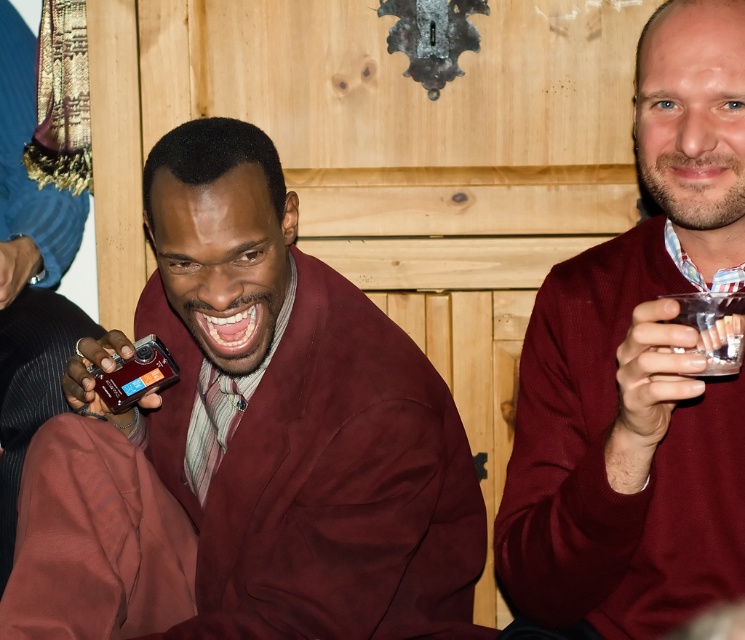
How far apart are matte burgundy sweater at left and maroon sweater at center?

matte burgundy sweater at left is 14.62 inches from maroon sweater at center.

The image size is (745, 640). Find the location of `matte burgundy sweater at left`. matte burgundy sweater at left is located at coordinates coord(247,442).

Find the location of `matte burgundy sweater at left`. matte burgundy sweater at left is located at coordinates (247, 442).